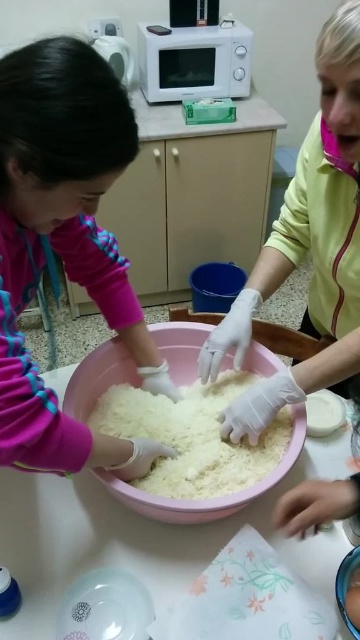
Question: Which object is positioned farthest from the white glossy table at center?

Choices:
 (A) white fluffy rice at center
 (B) pink fabric at center
 (C) white matte microwave at upper center

Answer: (C)

Question: Which point appears farthest from the camera in this image?

Choices:
 (A) (87, 461)
 (B) (164, 552)

Answer: (B)

Question: Can you confirm if white fluffy rice at center is bigger than white matte microwave at upper center?

Choices:
 (A) no
 (B) yes

Answer: (A)

Question: Which point appears closest to the camera in this image?

Choices:
 (A) (186, 40)
 (B) (6, 376)
 (C) (232, 451)
 (D) (62, 500)

Answer: (B)

Question: Is pink fabric at center to the right of white fluffy rice at center from the viewer's perspective?

Choices:
 (A) no
 (B) yes

Answer: (A)

Question: Can you confirm if white glossy table at center is smaller than white fluffy rice at center?

Choices:
 (A) no
 (B) yes

Answer: (A)